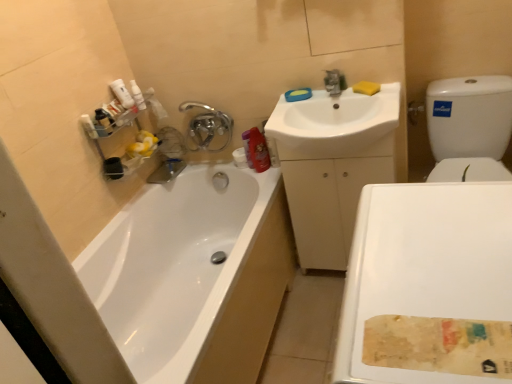
The width and height of the screenshot is (512, 384). Find the location of `free space above white glossy toilet at right (from a real-world perspective)`. free space above white glossy toilet at right (from a real-world perspective) is located at coordinates (432, 257).